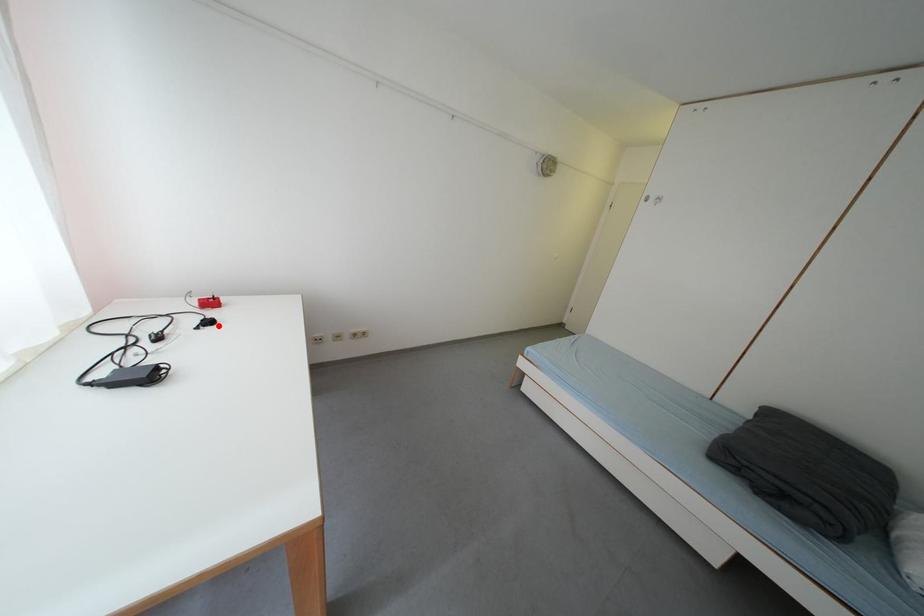
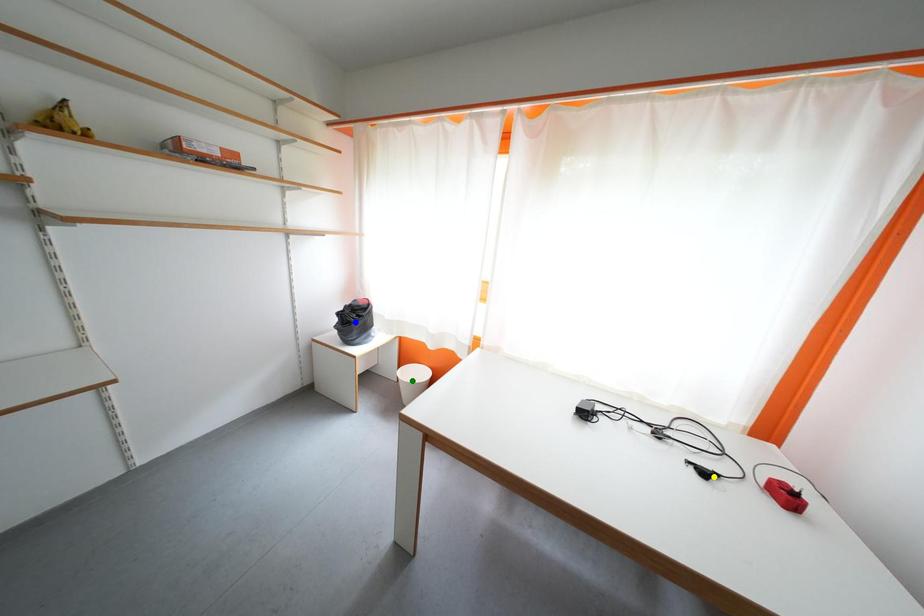
Question: I am providing you with two images of the same scene from different viewpoints. A red point is marked on the first image. You are given multiple points on the second image. Which spot in image 2 lines up with the point in image 1?

Choices:
 (A) yellow point
 (B) green point
 (C) blue point

Answer: (A)